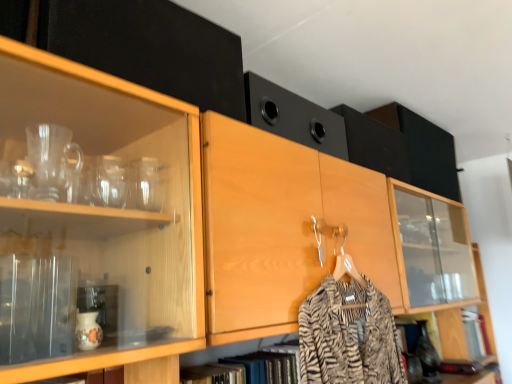
Question: From a real-world perspective, relative to black matte speaker at upper center, the 3th cabinetry when ordered from top to bottom, is wooden cabinet at lower right, the first cabinetry viewed from the right, vertically above or below?

Choices:
 (A) above
 (B) below

Answer: (B)

Question: From the image's perspective, is wooden cabinet at lower right, placed as the first cabinetry when sorted from back to front, located above or below black matte speaker at upper center, the 3th cabinetry when ordered from top to bottom?

Choices:
 (A) below
 (B) above

Answer: (A)

Question: Which object is the closest to the matte black cabinet at upper left, which is the 1th cabinetry from top to bottom?

Choices:
 (A) black matte speaker at upper center, acting as the 3th cabinetry starting from the right
 (B) wooden cabinet at lower right, placed as the first cabinetry when sorted from back to front
 (C) black matte speaker at upper center, the 3th cabinetry when ordered from top to bottom

Answer: (A)

Question: Which is nearer to the wooden cabinet at lower right, which is counted as the 4th cabinetry, starting from the front?

Choices:
 (A) black matte speaker at upper center, the 3th cabinetry viewed from the front
 (B) black matte speaker at upper center, which is the second cabinetry from top to bottom
 (C) matte black cabinet at upper left, acting as the fourth cabinetry starting from the back

Answer: (A)